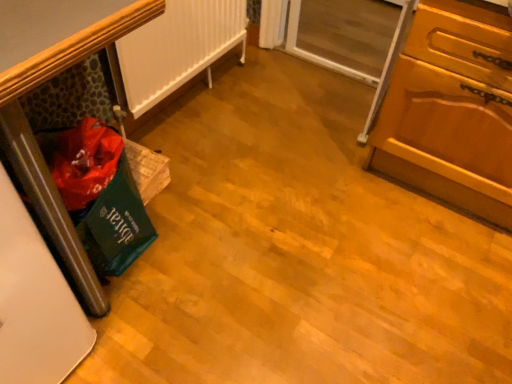
Find the location of a particular element. blank area beneath white matte radiator at left (from a real-world perspective) is located at coordinates (178, 108).